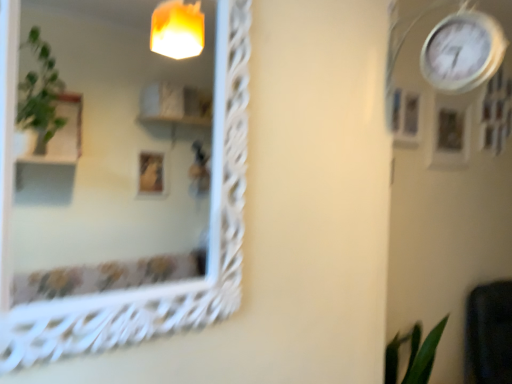
Question: Looking at the image, does matte white picture frame at upper right, the second picture frame from the back, seem bigger or smaller compared to white textured mirror at upper left?

Choices:
 (A) big
 (B) small

Answer: (B)

Question: From the image's perspective, relative to white textured mirror at upper left, is matte white picture frame at upper right, the second picture frame from the back, above or below?

Choices:
 (A) above
 (B) below

Answer: (A)

Question: Which object is positioned closest to the white metallic clock at upper right?

Choices:
 (A) matte white picture frame at upper right, marked as the 1th picture frame in a left-to-right arrangement
 (B) white textured mirror at upper left
 (C) wooden picture frame at upper right, the 2th picture frame positioned from the left

Answer: (A)

Question: Estimate the real-world distances between objects in this image. Which object is closer to the wooden picture frame at upper right, which is the first picture frame from back to front?

Choices:
 (A) white metallic clock at upper right
 (B) white textured mirror at upper left
 (C) matte white picture frame at upper right, marked as the 1th picture frame in a left-to-right arrangement

Answer: (C)